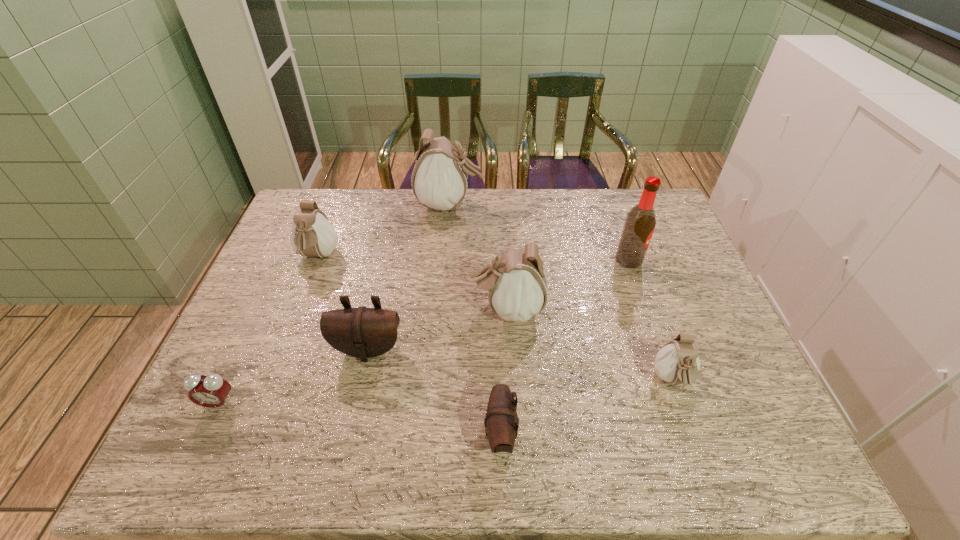
This screenshot has height=540, width=960. In order to click on free space located with the flap open on the farther brown pouch in this screenshot , I will do `click(353, 417)`.

The image size is (960, 540). Identify the location of vacant region located on the front-facing side of the nearest white pouch. (688, 424).

At what (x,y) coordinates should I click in order to perform the action: click on blank space located 0.130m with the flap open on the right brown pouch. Please return your answer as a coordinate pair (x, y). Looking at the image, I should click on (424, 434).

Where is `free spot located 0.280m with the flap open on the right brown pouch`? The image size is (960, 540). free spot located 0.280m with the flap open on the right brown pouch is located at coordinates (356, 434).

The image size is (960, 540). Find the location of `free space located with the flap open on the right brown pouch`. free space located with the flap open on the right brown pouch is located at coordinates (347, 434).

Identify the location of free spot located 0.100m on the clock face of the alarm clock. (195, 454).

Locate an element on the screen. object located in the far edge section of the desktop is located at coordinates (439, 180).

The width and height of the screenshot is (960, 540). Find the location of `object that is positioned at the near edge`. object that is positioned at the near edge is located at coordinates (501, 418).

The width and height of the screenshot is (960, 540). In order to click on pouch that is at the left edge in this screenshot , I will do `click(312, 235)`.

Locate an element on the screen. This screenshot has width=960, height=540. alarm clock that is at the left edge is located at coordinates (211, 391).